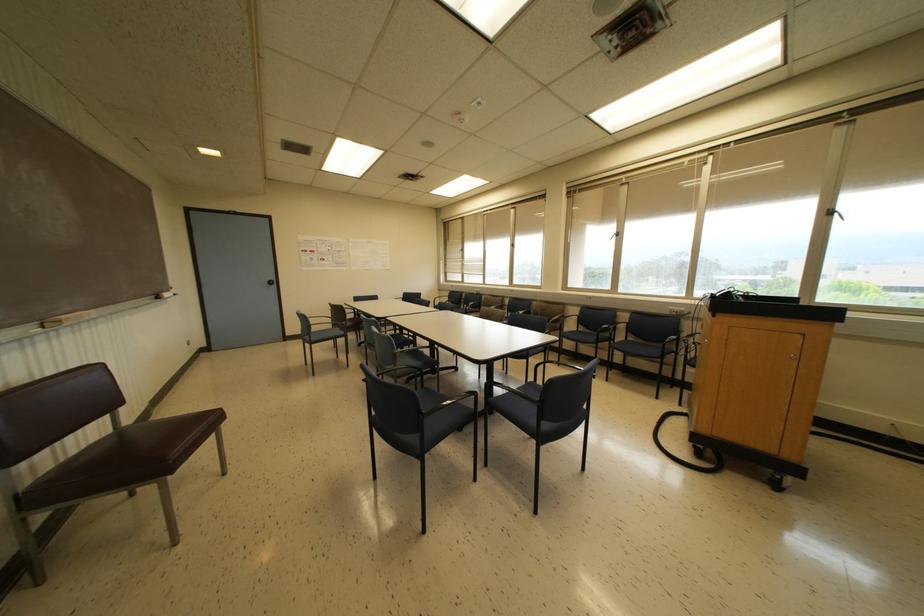
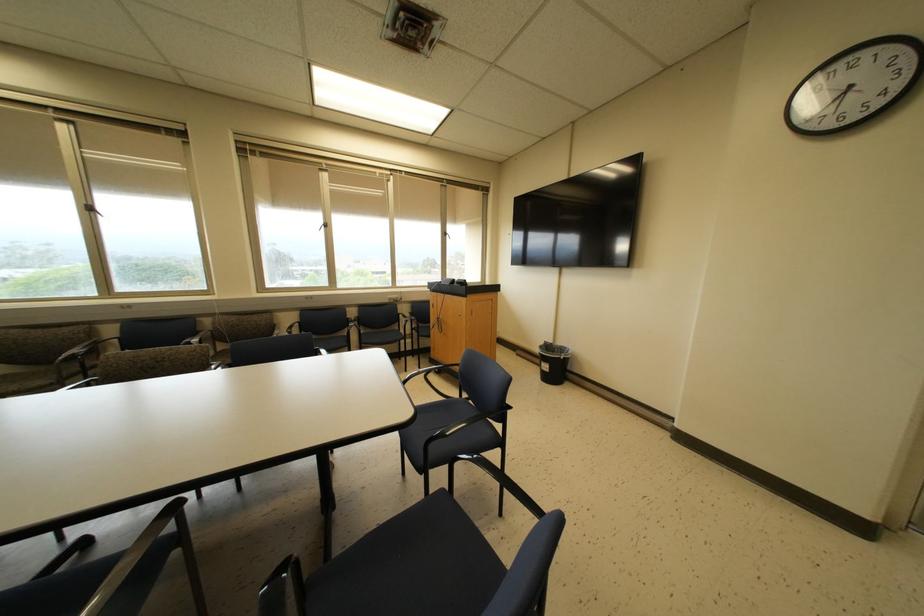
Where in the second image is the point corresponding to point (827, 213) from the first image?

(444, 233)